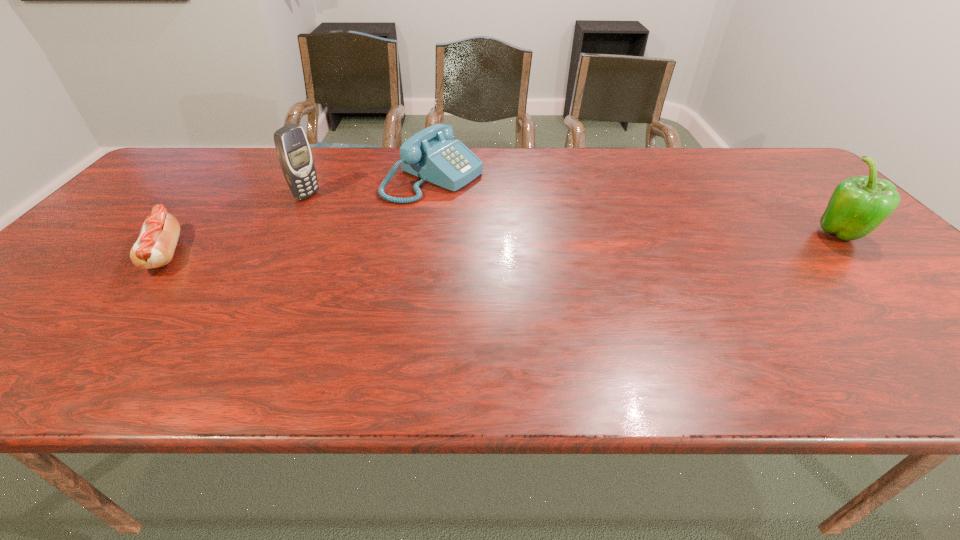
This screenshot has height=540, width=960. In the image, there is a desktop. In order to click on free space at the far left corner in this screenshot , I will do `click(200, 171)`.

The width and height of the screenshot is (960, 540). Identify the location of free point at the far right corner. (731, 150).

The height and width of the screenshot is (540, 960). I want to click on free space between the rightmost object and the shortest object, so click(503, 245).

The width and height of the screenshot is (960, 540). In order to click on empty space that is in between the cellular telephone and the leftmost object in this screenshot , I will do `click(236, 224)`.

At what (x,y) coordinates should I click in order to perform the action: click on free space that is in between the third object from right to left and the shortest object. Please return your answer as a coordinate pair (x, y). Looking at the image, I should click on (236, 224).

Locate an element on the screen. The height and width of the screenshot is (540, 960). empty location between the third object from right to left and the rightmost object is located at coordinates (574, 216).

Where is `vacant space that is in between the shortest object and the cellular telephone`? The image size is (960, 540). vacant space that is in between the shortest object and the cellular telephone is located at coordinates (236, 224).

I want to click on vacant space in between the rightmost object and the second object from right to left, so click(x=637, y=207).

I want to click on free spot between the third object from left to right and the third object from right to left, so pyautogui.click(x=371, y=187).

The width and height of the screenshot is (960, 540). Find the location of `free space between the third tallest object and the bell pepper`. free space between the third tallest object and the bell pepper is located at coordinates (637, 207).